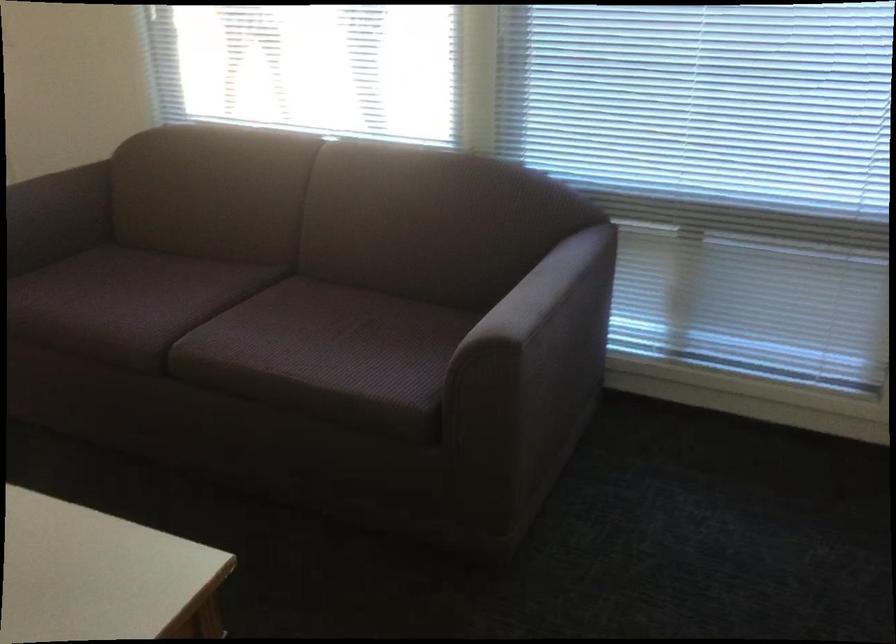
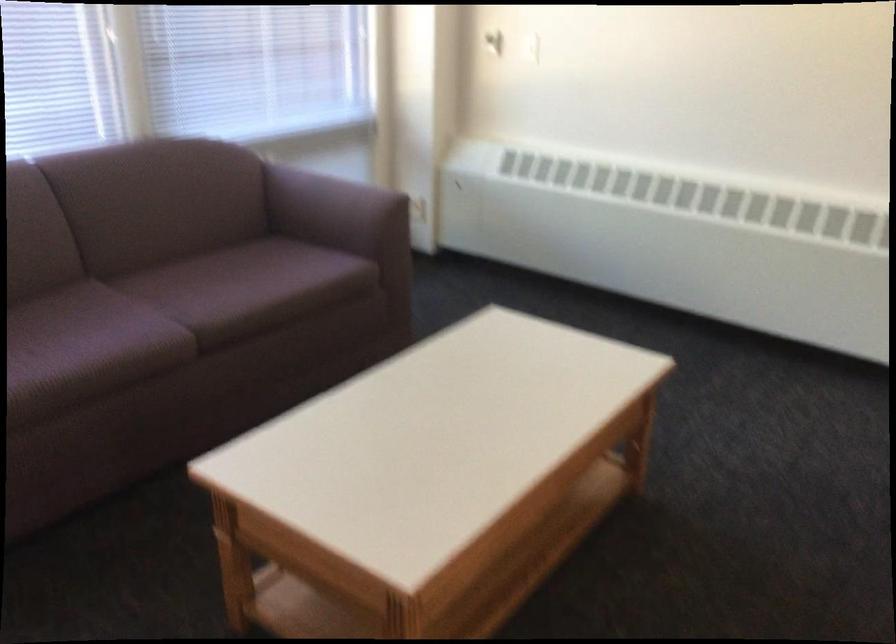
Where in the second image is the point corresponding to pixel 500 323 from the first image?

(336, 211)